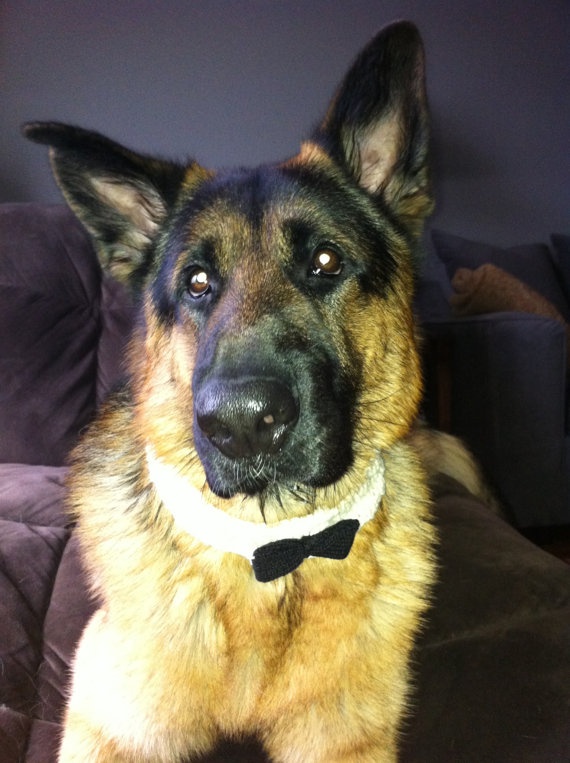
Where is `blanket`? This screenshot has width=570, height=763. blanket is located at coordinates (500, 282).